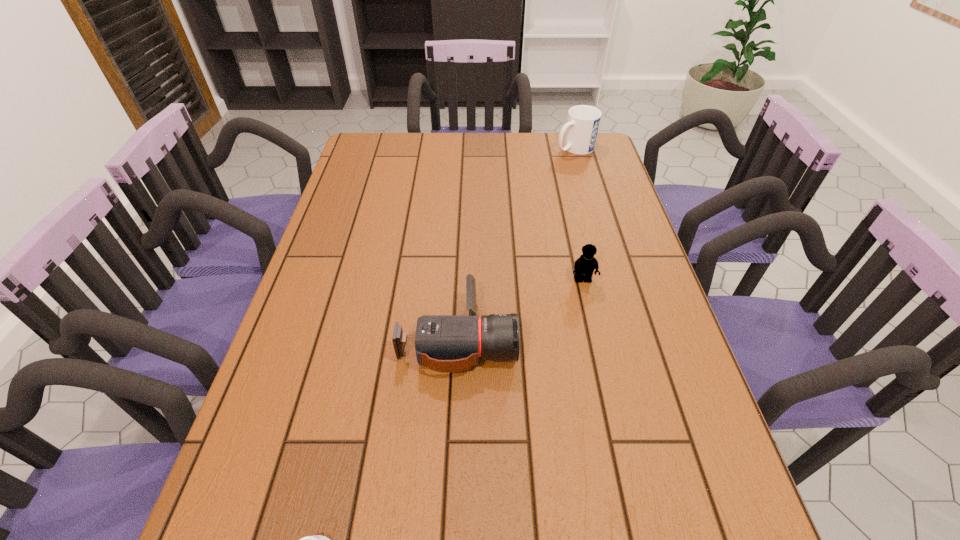
Where is `object that is positioned at the far right corner`? object that is positioned at the far right corner is located at coordinates (583, 121).

The image size is (960, 540). I want to click on free location at the far edge of the desktop, so click(526, 136).

Where is `vacant space at the left edge of the desktop`? This screenshot has height=540, width=960. vacant space at the left edge of the desktop is located at coordinates (342, 380).

Image resolution: width=960 pixels, height=540 pixels. What are the coordinates of `free space at the right edge of the desktop` in the screenshot? It's located at (623, 371).

Where is `blank region between the third farthest object and the mug`? Image resolution: width=960 pixels, height=540 pixels. blank region between the third farthest object and the mug is located at coordinates (516, 242).

You are a GUI agent. You are given a task and a screenshot of the screen. Output one action in this format:
    pyautogui.click(x=<x>, y=<y>)
    Task: Click on the vacant space that is in between the mug and the third nearest object
    
    Given the screenshot: What is the action you would take?
    pyautogui.click(x=579, y=214)

The image size is (960, 540). Identify the location of free point between the mug and the second nearest object. (516, 242).

Where is `free spot between the farthest object and the second object from left to right`? Image resolution: width=960 pixels, height=540 pixels. free spot between the farthest object and the second object from left to right is located at coordinates (516, 242).

Where is `free spot between the mug and the camcorder`? This screenshot has width=960, height=540. free spot between the mug and the camcorder is located at coordinates (516, 242).

The image size is (960, 540). Find the location of `object that is the third closest to the second object from left to right`. object that is the third closest to the second object from left to right is located at coordinates (583, 121).